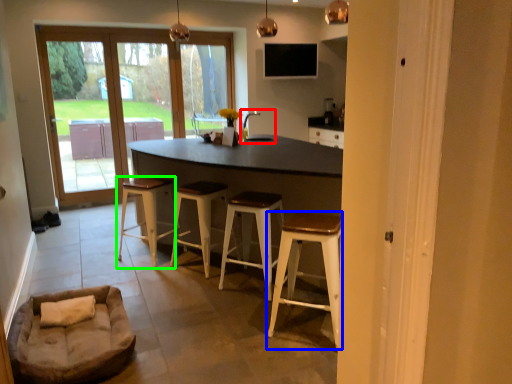
Question: Based on their relative distances, which object is nearer to sink (highlighted by a red box)? Choose from stool (highlighted by a blue box) and stool (highlighted by a green box).

Choices:
 (A) stool
 (B) stool

Answer: (B)